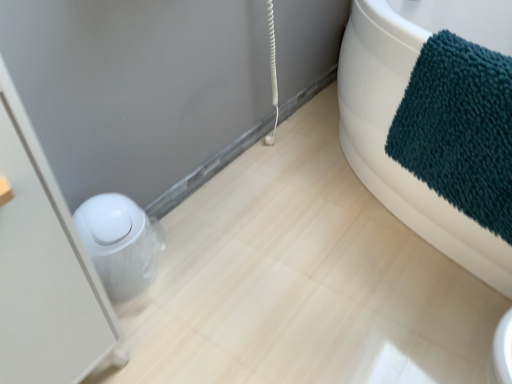
You are a GUI agent. You are given a task and a screenshot of the screen. Output one action in this format:
    pyautogui.click(x=<x>, y=<y>)
    Task: Click on the teal plush towel at upper right
    This screenshot has width=512, height=384.
    Given the screenshot: What is the action you would take?
    pyautogui.click(x=394, y=114)

Based on the photo, from a real-world perspective, relative to teal plush towel at upper right, is white glossy toilet bowl at lower left vertically above or below?

white glossy toilet bowl at lower left is situated lower than teal plush towel at upper right in the real world.

Is teal plush towel at upper right located within white glossy toilet bowl at lower left?

No.

Who is bigger, white glossy toilet bowl at lower left or teal plush towel at upper right?

teal plush towel at upper right is bigger.

You are a GUI agent. You are given a task and a screenshot of the screen. Output one action in this format:
    pyautogui.click(x=<x>, y=<y>)
    Task: Click on the toilet bowl located below the teal plush towel at upper right (from the image's perspective)
    
    Given the screenshot: What is the action you would take?
    pyautogui.click(x=120, y=243)

How different are the orientations of teal plush towel at upper right and white glossy toilet bowl at lower left in degrees?

teal plush towel at upper right and white glossy toilet bowl at lower left are facing 116 degrees away from each other.

Does teal plush towel at upper right have a lesser height compared to white glossy toilet bowl at lower left?

No.

Does teal plush towel at upper right have a lesser width compared to white glossy toilet bowl at lower left?

No, teal plush towel at upper right is not thinner than white glossy toilet bowl at lower left.

Considering the relative sizes of white glossy toilet bowl at lower left and white glossy trash can at left in the image provided, is white glossy toilet bowl at lower left taller than white glossy trash can at left?

Incorrect, the height of white glossy toilet bowl at lower left is not larger of that of white glossy trash can at left.

Consider the image. Is white glossy toilet bowl at lower left spatially inside white glossy trash can at left, or outside of it?

white glossy toilet bowl at lower left exists outside the volume of white glossy trash can at left.

Considering the sizes of objects white glossy toilet bowl at lower left and white glossy trash can at left in the image provided, who is bigger, white glossy toilet bowl at lower left or white glossy trash can at left?

white glossy trash can at left is bigger.

Considering the sizes of objects white glossy toilet bowl at lower left and white glossy trash can at left in the image provided, who is wider, white glossy toilet bowl at lower left or white glossy trash can at left?

white glossy trash can at left is wider.

From the picture: Is teal plush towel at upper right to the left or to the right of white glossy trash can at left in the image?

From the image, it's evident that teal plush towel at upper right is to the right of white glossy trash can at left.

Locate an element on the screen. The height and width of the screenshot is (384, 512). bathtub lying above the white glossy trash can at left (from the image's perspective) is located at coordinates (394, 114).

Who is bigger, teal plush towel at upper right or white glossy trash can at left?

white glossy trash can at left.

Is the surface of teal plush towel at upper right in direct contact with white glossy trash can at left?

No, teal plush towel at upper right is not beside white glossy trash can at left.

From the picture: Does white glossy trash can at left have a lesser height compared to white glossy toilet bowl at lower left?

Incorrect, the height of white glossy trash can at left does not fall short of that of white glossy toilet bowl at lower left.

Is white glossy trash can at left with white glossy toilet bowl at lower left?

No, white glossy trash can at left is not touching white glossy toilet bowl at lower left.

Is white glossy trash can at left looking in the opposite direction of white glossy toilet bowl at lower left?

white glossy trash can at left is not turned away from white glossy toilet bowl at lower left.

Is white glossy trash can at left located outside white glossy toilet bowl at lower left?

That's correct, white glossy trash can at left is outside of white glossy toilet bowl at lower left.

From the picture: From a real-world perspective, who is located higher, white glossy trash can at left or teal plush towel at upper right?

From a 3D spatial view, white glossy trash can at left is above.

Does white glossy trash can at left have a greater height compared to teal plush towel at upper right?

Correct, white glossy trash can at left is much taller as teal plush towel at upper right.

Is white glossy trash can at left next to teal plush towel at upper right and touching it?

white glossy trash can at left is not next to teal plush towel at upper right, and they're not touching.

Locate an element on the screen. The image size is (512, 384). bathtub above the white glossy toilet bowl at lower left (from a real-world perspective) is located at coordinates (394, 114).

Locate an element on the screen. This screenshot has width=512, height=384. toilet bowl below the teal plush towel at upper right (from the image's perspective) is located at coordinates (120, 243).

Looking at the image, which one is located closer to white glossy trash can at left, white glossy toilet bowl at lower left or teal plush towel at upper right?

Based on the image, white glossy toilet bowl at lower left appears to be nearer to white glossy trash can at left.

Looking at the image, which one is located closer to teal plush towel at upper right, white glossy trash can at left or white glossy toilet bowl at lower left?

Among the two, white glossy toilet bowl at lower left is located nearer to teal plush towel at upper right.

Based on the photo, based on their spatial positions, is teal plush towel at upper right or white glossy trash can at left further from white glossy toilet bowl at lower left?

Based on the image, teal plush towel at upper right appears to be further to white glossy toilet bowl at lower left.

When comparing their distances from white glossy trash can at left, does teal plush towel at upper right or white glossy toilet bowl at lower left seem further?

teal plush towel at upper right.

Looking at the image, which one is located further to white glossy toilet bowl at lower left, white glossy trash can at left or teal plush towel at upper right?

The object further to white glossy toilet bowl at lower left is teal plush towel at upper right.

Estimate the real-world distances between objects in this image. Which object is closer to teal plush towel at upper right, white glossy toilet bowl at lower left or white glossy trash can at left?

white glossy toilet bowl at lower left is positioned closer to the anchor teal plush towel at upper right.

This screenshot has height=384, width=512. In order to click on toilet bowl between white glossy trash can at left and teal plush towel at upper right in the horizontal direction in this screenshot , I will do `click(120, 243)`.